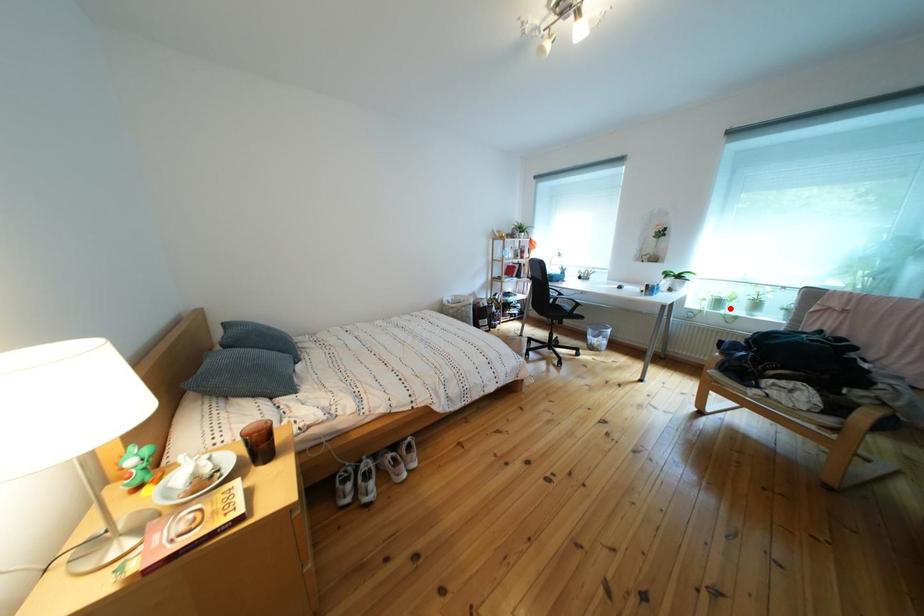
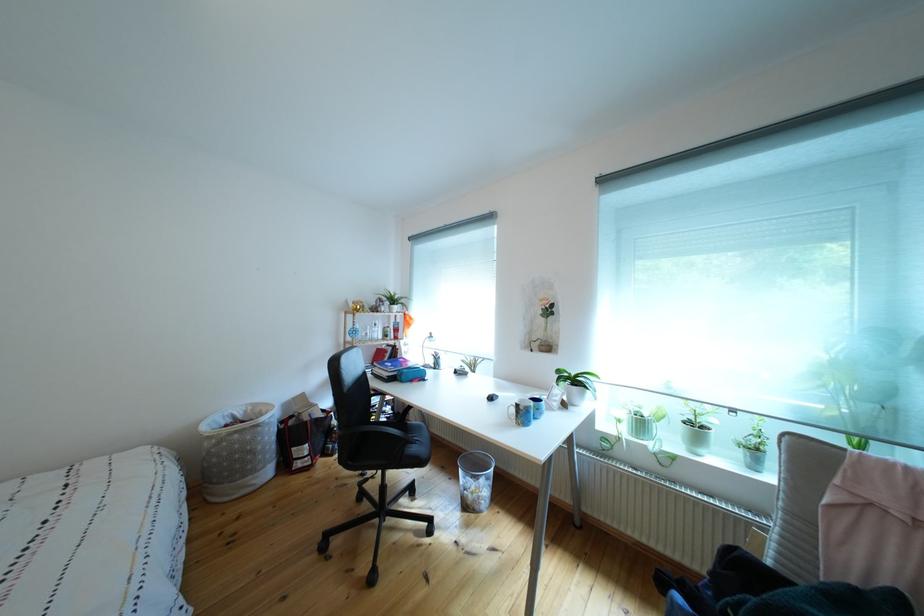
In the second image, find the point that corresponds to the highlighted location in the first image.

(652, 430)